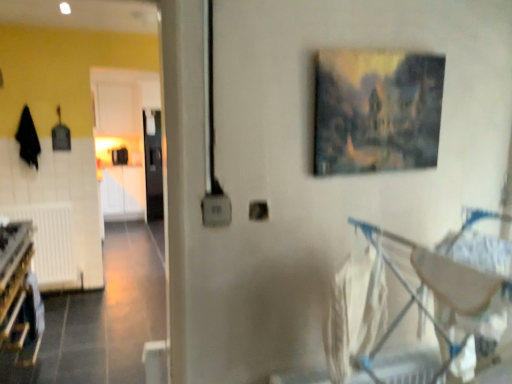
Question: Can you confirm if white matte radiator at lower left is positioned to the right of wooden bunk bed at lower left?

Choices:
 (A) yes
 (B) no

Answer: (B)

Question: From a real-world perspective, does white matte radiator at lower left stand above wooden bunk bed at lower left?

Choices:
 (A) no
 (B) yes

Answer: (A)

Question: Can you confirm if white matte radiator at lower left is taller than wooden bunk bed at lower left?

Choices:
 (A) no
 (B) yes

Answer: (B)

Question: Is white matte radiator at lower left bigger than wooden bunk bed at lower left?

Choices:
 (A) yes
 (B) no

Answer: (A)

Question: From the image's perspective, does white matte radiator at lower left appear lower than wooden bunk bed at lower left?

Choices:
 (A) no
 (B) yes

Answer: (B)

Question: Can you confirm if white matte radiator at lower left is wider than wooden bunk bed at lower left?

Choices:
 (A) no
 (B) yes

Answer: (A)

Question: Does wooden bunk bed at lower left appear on the left side of metallic silver baby carriage at lower right?

Choices:
 (A) no
 (B) yes

Answer: (B)

Question: Is metallic silver baby carriage at lower right a part of wooden bunk bed at lower left?

Choices:
 (A) no
 (B) yes

Answer: (A)

Question: Is wooden bunk bed at lower left with metallic silver baby carriage at lower right?

Choices:
 (A) yes
 (B) no

Answer: (B)

Question: Does wooden bunk bed at lower left have a greater height compared to metallic silver baby carriage at lower right?

Choices:
 (A) yes
 (B) no

Answer: (B)

Question: From the image's perspective, is wooden bunk bed at lower left beneath metallic silver baby carriage at lower right?

Choices:
 (A) no
 (B) yes

Answer: (A)

Question: From a real-world perspective, is wooden bunk bed at lower left beneath metallic silver baby carriage at lower right?

Choices:
 (A) yes
 (B) no

Answer: (A)

Question: Is the position of wooden bunk bed at lower left less distant than that of oil painting at upper center?

Choices:
 (A) no
 (B) yes

Answer: (A)